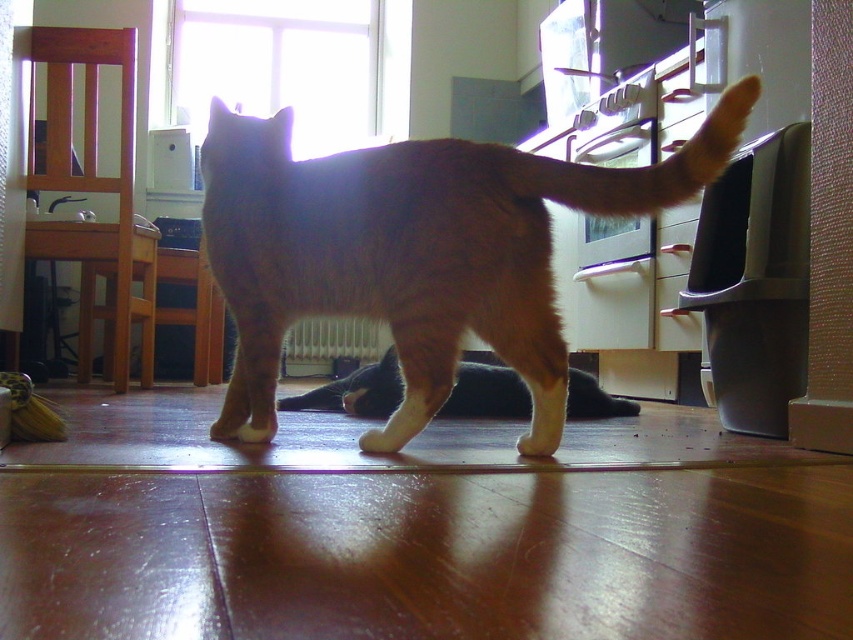
Who is lower down, orange fur tabby cat at center or white fur paw at lower center?

white fur paw at lower center is below.

Does orange fur tabby cat at center have a lesser width compared to white fur paw at lower center?

In fact, orange fur tabby cat at center might be wider than white fur paw at lower center.

Does point (506, 234) lie behind point (531, 433)?

No, (506, 234) is closer to viewer.

Where is `orange fur tabby cat at center`? Image resolution: width=853 pixels, height=640 pixels. orange fur tabby cat at center is located at coordinates pyautogui.click(x=413, y=248).

Who is shorter, orange fur tail at upper right or white matte paw at center?

white matte paw at center is shorter.

Can you confirm if orange fur tail at upper right is positioned to the right of white matte paw at center?

Correct, you'll find orange fur tail at upper right to the right of white matte paw at center.

What do you see at coordinates (640, 166) in the screenshot?
I see `orange fur tail at upper right` at bounding box center [640, 166].

Locate an element on the screen. This screenshot has width=853, height=640. orange fur tail at upper right is located at coordinates (640, 166).

Can you confirm if orange fur tail at upper right is positioned below white fur paw at lower center?

No, orange fur tail at upper right is not below white fur paw at lower center.

Is point (689, 156) farther from camera compared to point (532, 452)?

No, (689, 156) is closer to viewer.

Where is `orange fur tail at upper right`? This screenshot has height=640, width=853. orange fur tail at upper right is located at coordinates (640, 166).